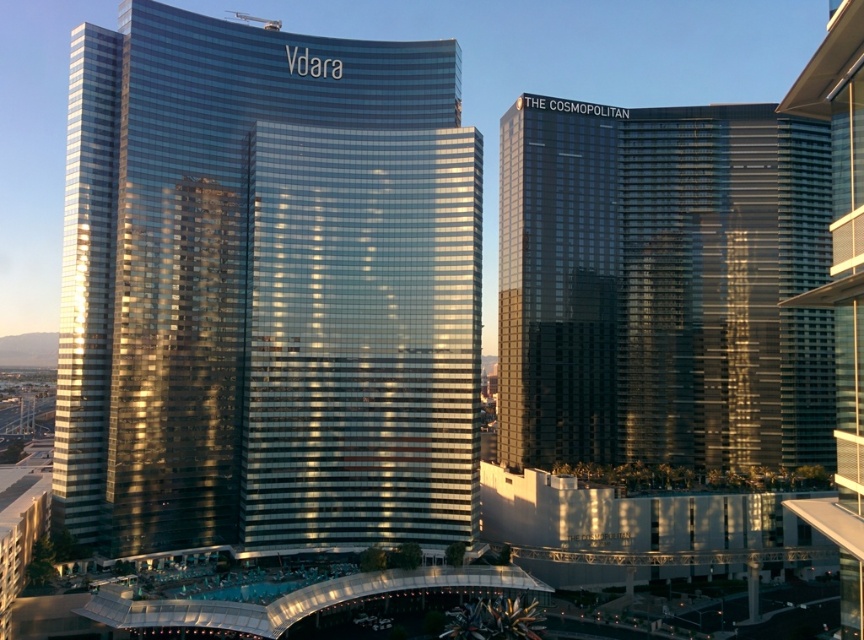
Question: Can you confirm if shiny glass building at center is wider than shiny glass building at right?

Choices:
 (A) no
 (B) yes

Answer: (A)

Question: Among these objects, which one is farthest from the camera?

Choices:
 (A) shiny glass building at right
 (B) shiny glass building at center

Answer: (A)

Question: Can you confirm if shiny glass building at center is positioned below shiny glass building at right?

Choices:
 (A) no
 (B) yes

Answer: (A)

Question: Can you confirm if shiny glass building at center is positioned to the left of shiny glass building at right?

Choices:
 (A) no
 (B) yes

Answer: (B)

Question: Among these points, which one is nearest to the camera?

Choices:
 (A) (137, 113)
 (B) (500, 266)

Answer: (A)